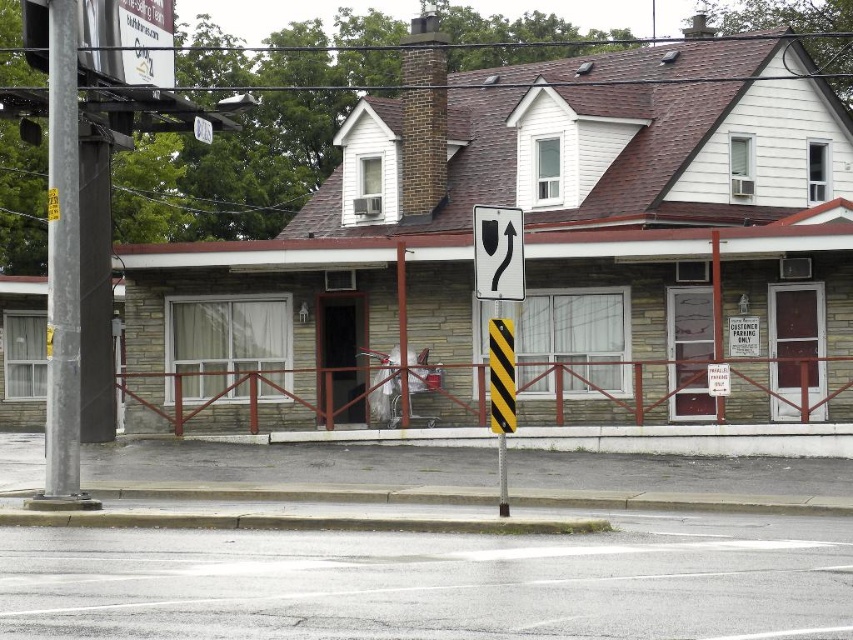
Question: Which object is the farthest from the black plastic traffic sign at center?

Choices:
 (A) asphalt at lower center
 (B) black/yellow striped post at center
 (C) metallic gray pole at left

Answer: (C)

Question: Can you confirm if asphalt at lower center is positioned to the left of black plastic traffic sign at center?

Choices:
 (A) yes
 (B) no

Answer: (B)

Question: Based on their relative distances, which object is nearer to the asphalt at lower center?

Choices:
 (A) black/yellow striped post at center
 (B) metallic gray pole at left
 (C) black plastic traffic sign at center

Answer: (A)

Question: Considering the relative positions of asphalt at lower center and metallic gray pole at left in the image provided, where is asphalt at lower center located with respect to metallic gray pole at left?

Choices:
 (A) below
 (B) above

Answer: (A)

Question: Which point appears farthest from the camera in this image?

Choices:
 (A) (515, 266)
 (B) (78, 214)

Answer: (B)

Question: Can you confirm if metallic gray pole at left is wider than black/yellow striped post at center?

Choices:
 (A) no
 (B) yes

Answer: (B)